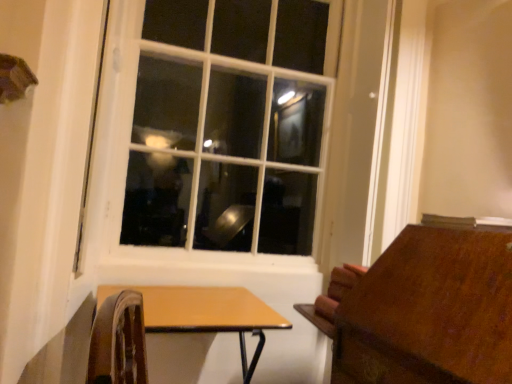
This screenshot has height=384, width=512. In order to click on vacant space situated above wooden table at center (from a real-world perspective) in this screenshot , I will do `click(209, 308)`.